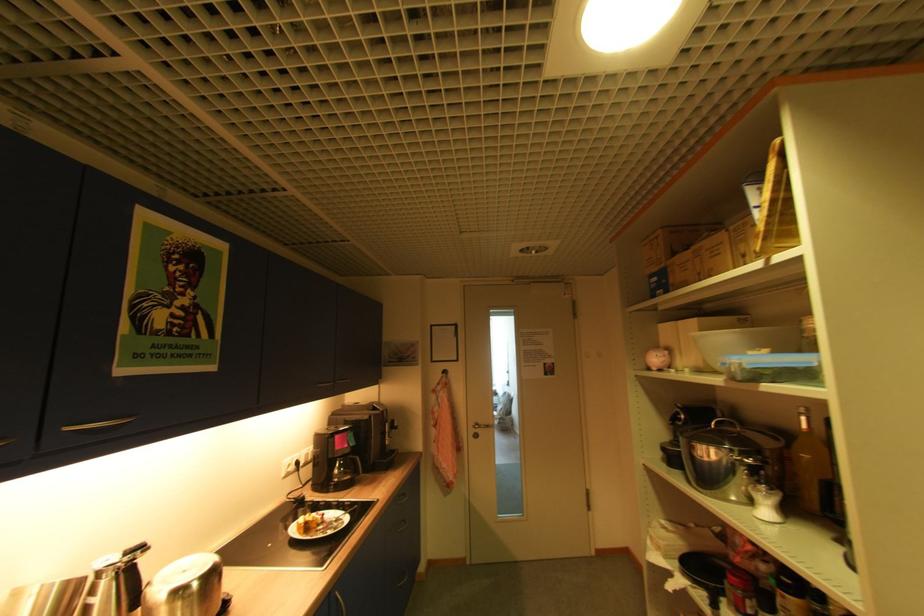
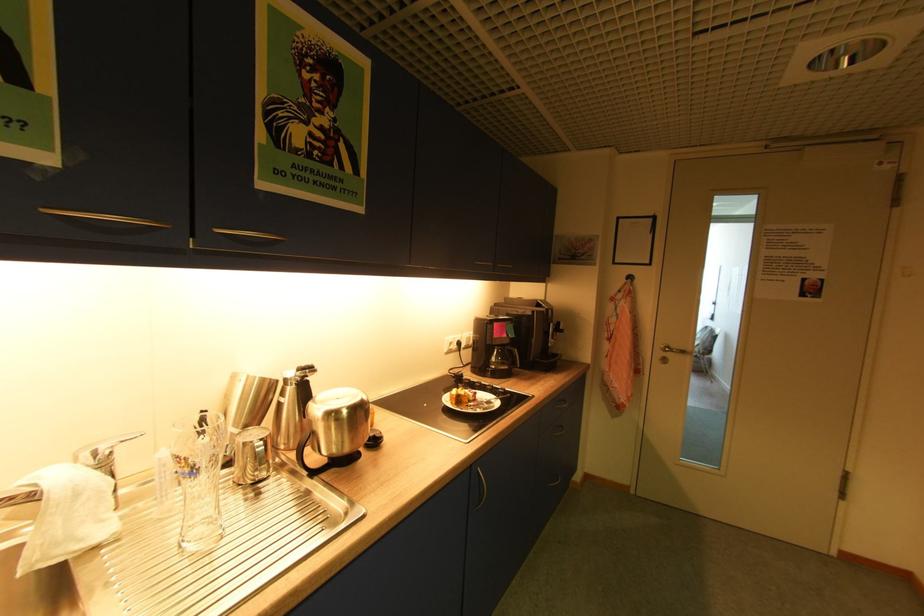
Question: The images are taken continuously from a first-person perspective. In which direction is your viewpoint rotating?

Choices:
 (A) Left
 (B) Right
 (C) Up
 (D) Down

Answer: (A)